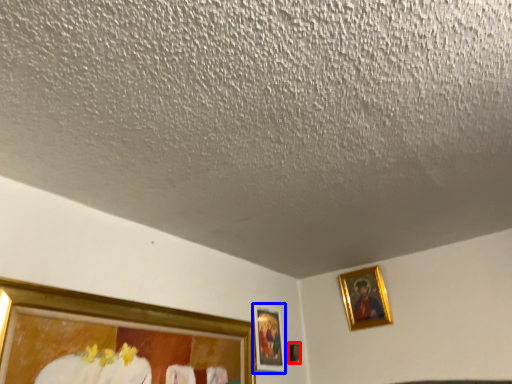
Question: Which point is further to the camera, picture frame (highlighted by a red box) or picture frame (highlighted by a blue box)?

Choices:
 (A) picture frame
 (B) picture frame

Answer: (A)